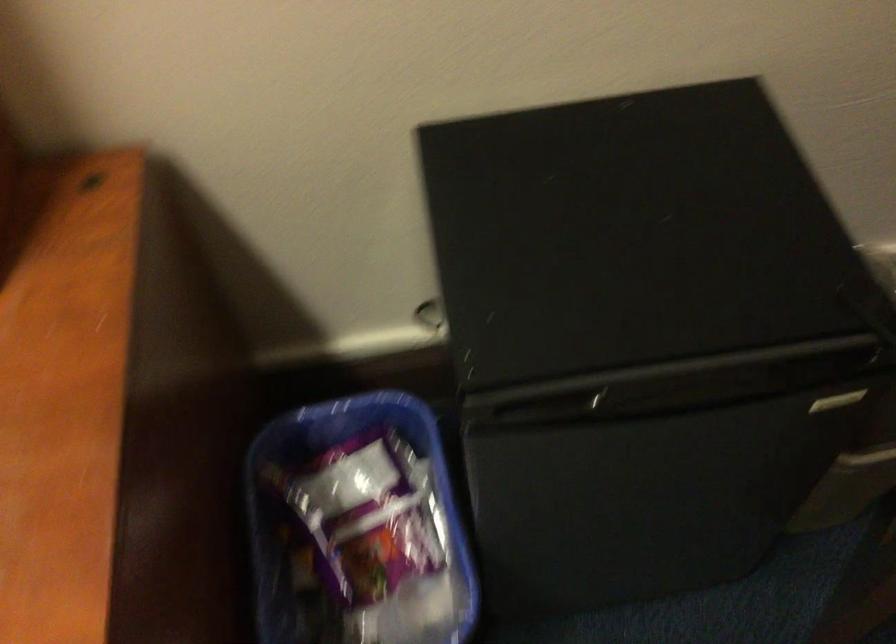
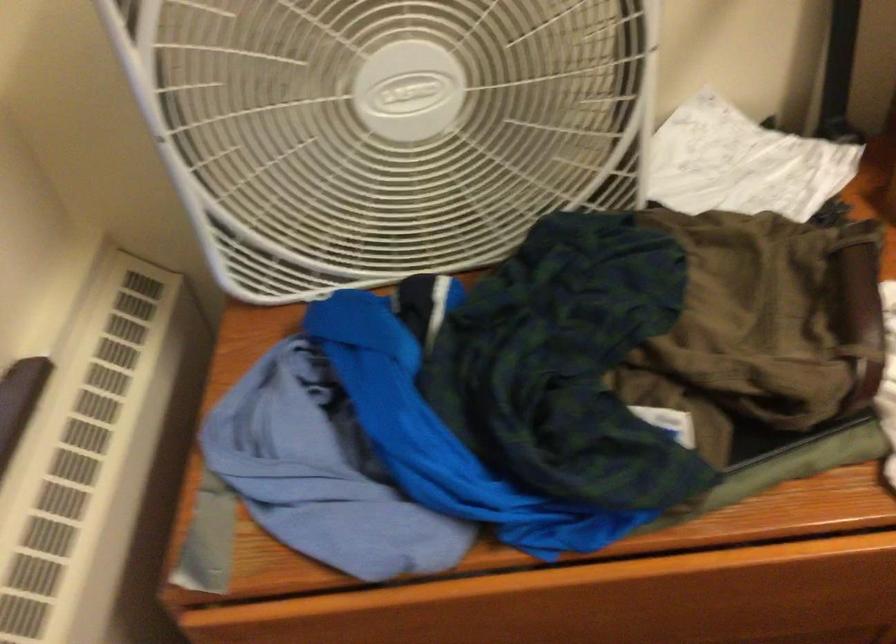
Question: Which direction would the cameraman need to move to produce the second image? Reply with the corresponding letter.

Choices:
 (A) Left
 (B) Right
 (C) Forward
 (D) Backward

Answer: (A)